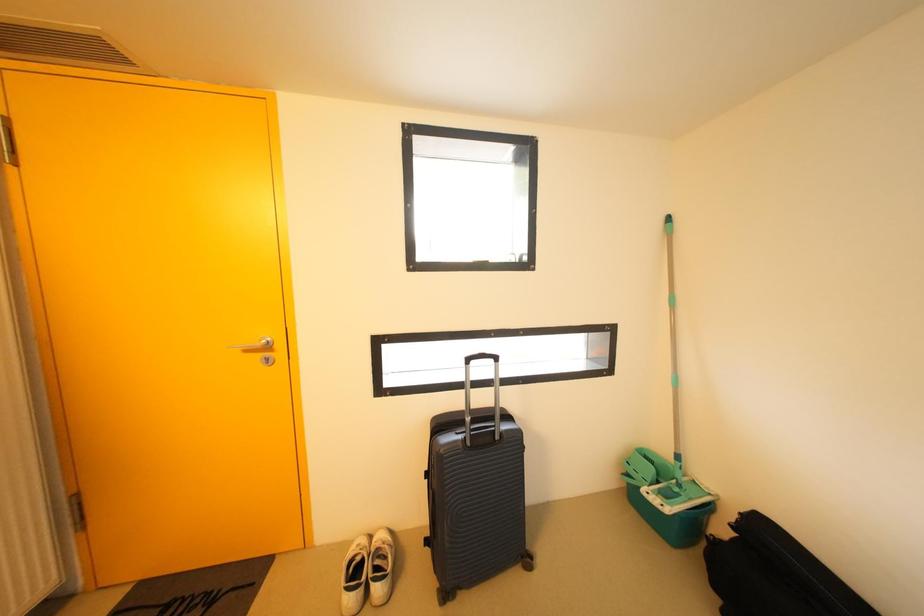
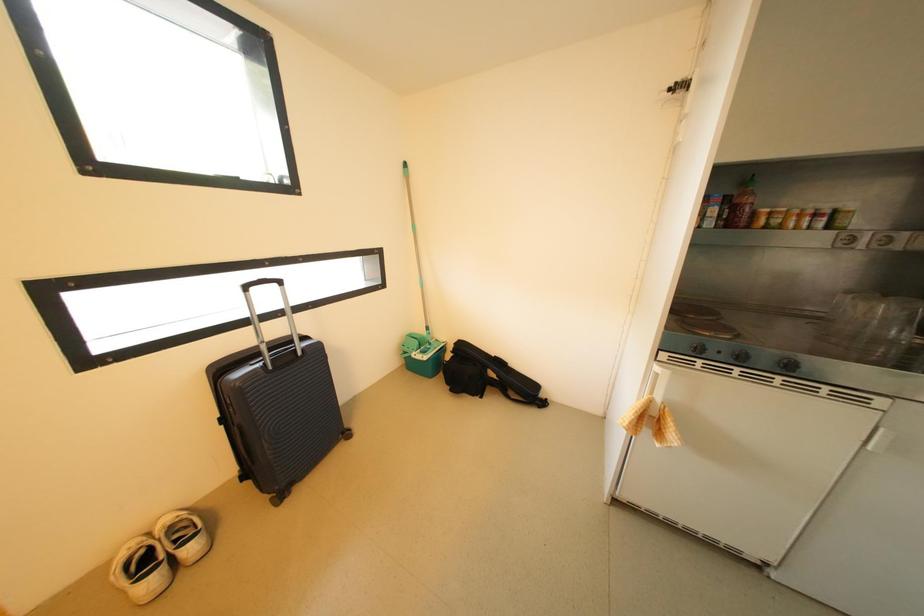
Question: Based on the continuous images, in which direction is the camera rotating? Reply with the corresponding letter.

Choices:
 (A) Left
 (B) Right
 (C) Up
 (D) Down

Answer: (B)